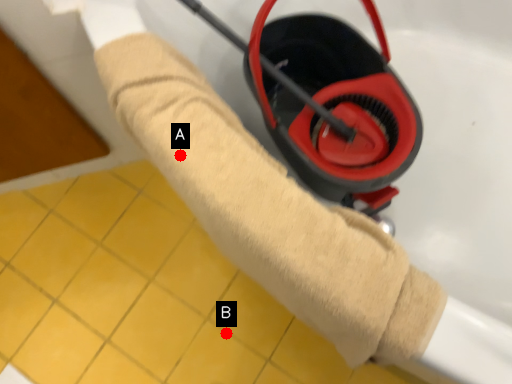
Question: Two points are circled on the image, labeled by A and B beside each circle. Which of the following is the closest to the observer?

Choices:
 (A) A is closer
 (B) B is closer

Answer: (A)